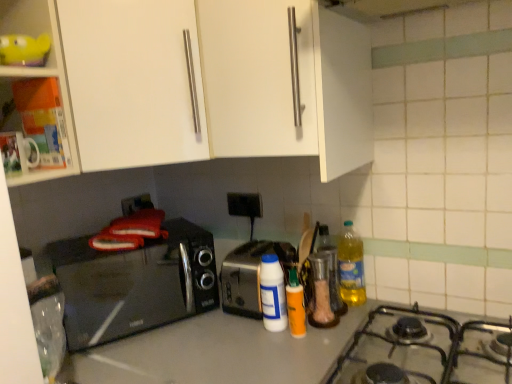
The height and width of the screenshot is (384, 512). In order to click on free region on the left part of orange matte bottle at center, the second bottle from the right in this screenshot , I will do `click(237, 339)`.